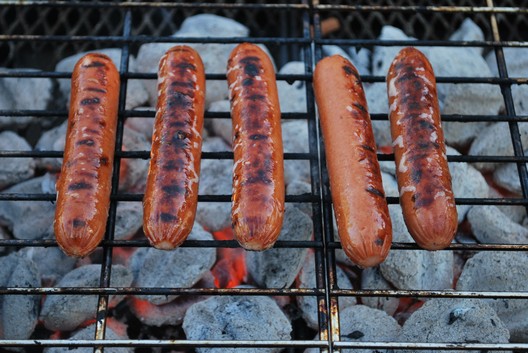
Where is `grate`? The image size is (528, 353). grate is located at coordinates pos(76,35).